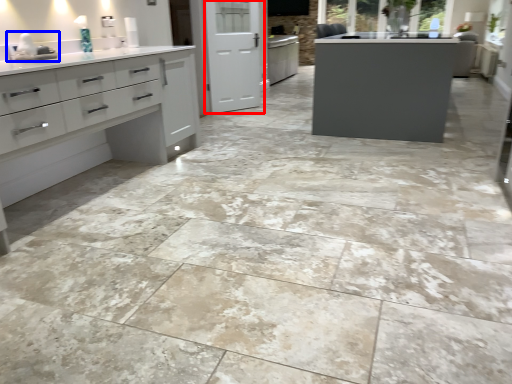
Question: Which of the following is the farthest to the observer, screen door (highlighted by a red box) or sink (highlighted by a blue box)?

Choices:
 (A) screen door
 (B) sink

Answer: (A)